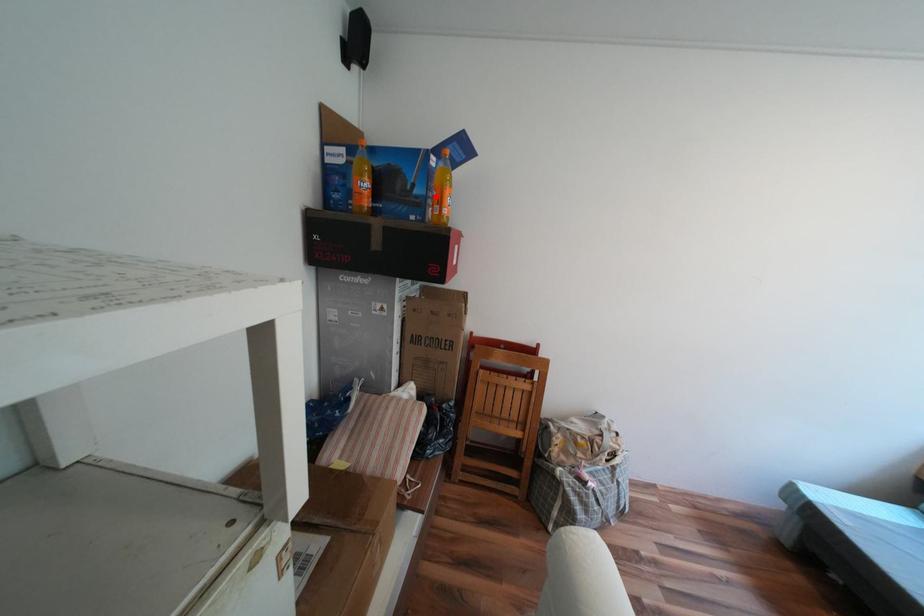
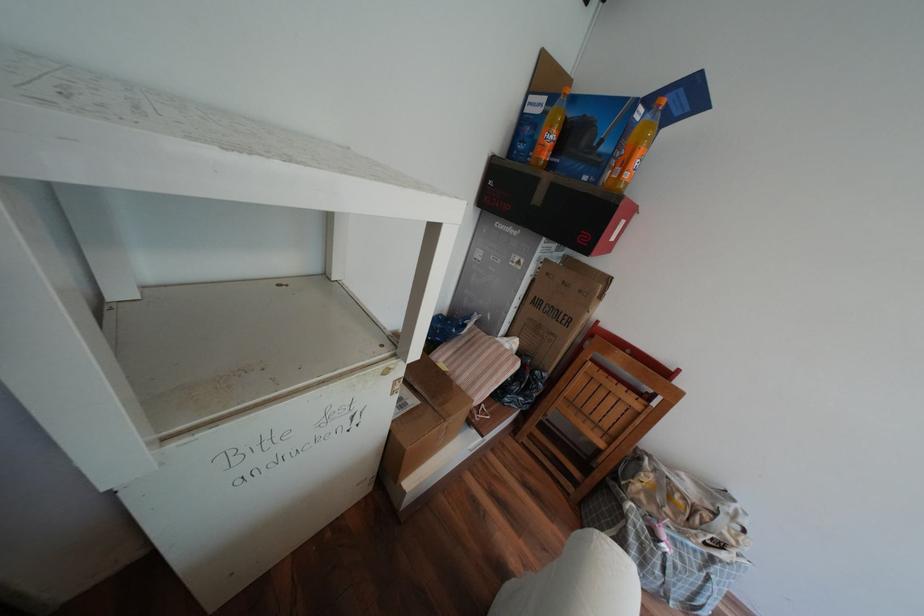
In the second image, find the point that corresponds to the highlighted location in the first image.

(621, 156)